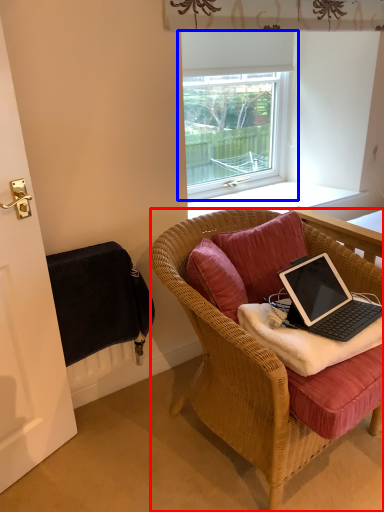
Question: Which of the following is the closest to the observer, chair (highlighted by a red box) or window (highlighted by a blue box)?

Choices:
 (A) chair
 (B) window

Answer: (A)